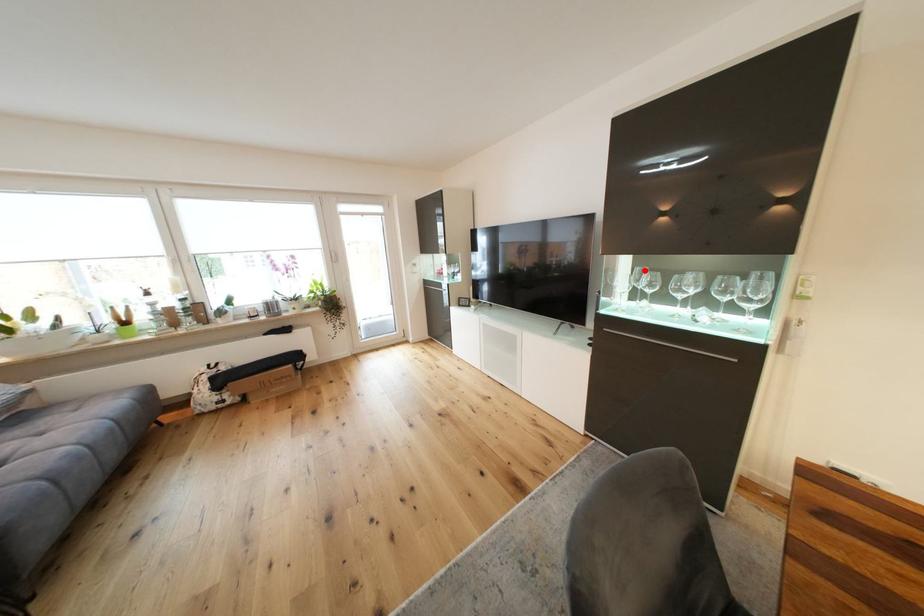
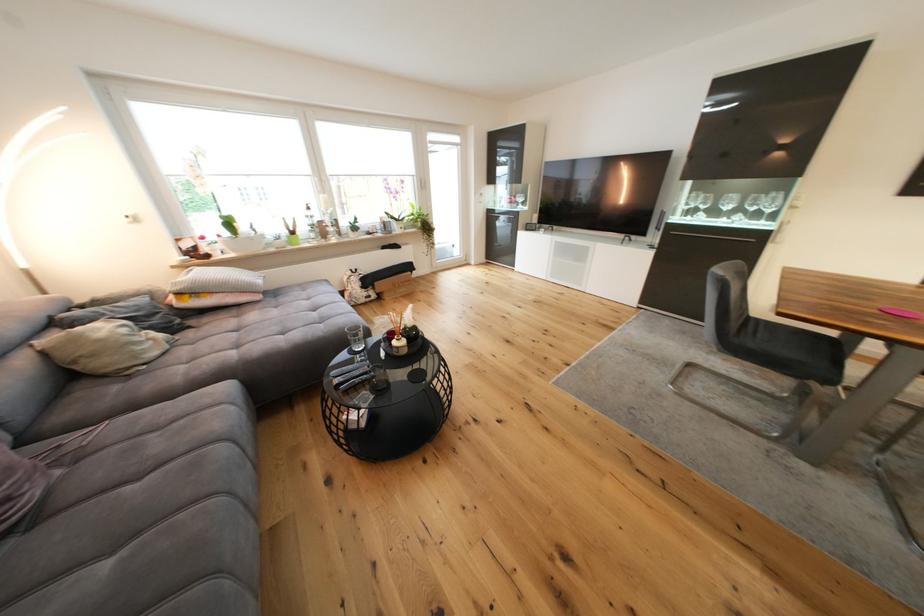
The point at the highlighted location is marked in the first image. Where is the corresponding point in the second image?

(701, 195)